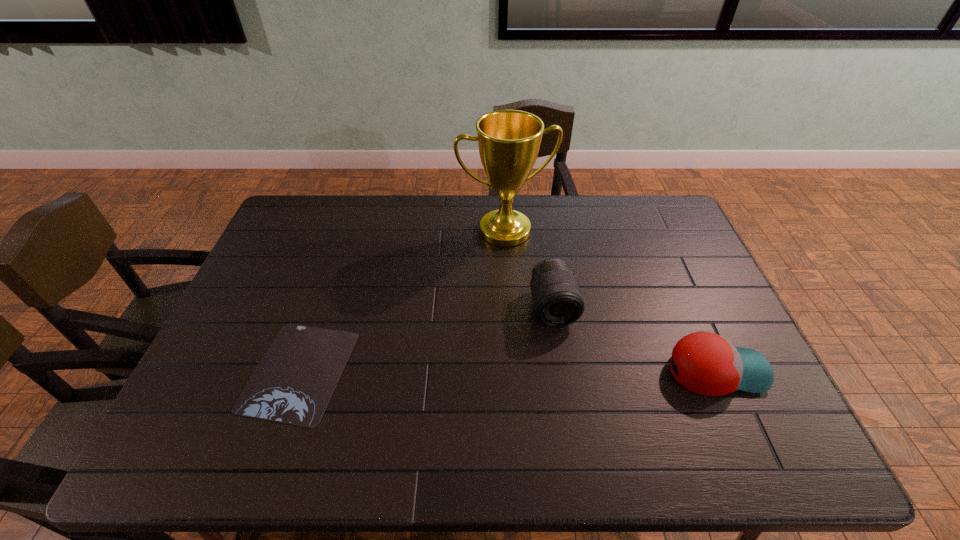
Image resolution: width=960 pixels, height=540 pixels. In order to click on object present at the near right corner in this screenshot , I will do `click(708, 364)`.

In the image, there is a desktop. Identify the location of vacant space at the far edge. (617, 198).

Where is `vacant region at the near edge of the desktop`? vacant region at the near edge of the desktop is located at coordinates click(571, 399).

Where is `blank area at the left edge`? The height and width of the screenshot is (540, 960). blank area at the left edge is located at coordinates tap(235, 372).

This screenshot has height=540, width=960. I want to click on vacant space at the right edge, so click(705, 296).

The image size is (960, 540). I want to click on free spot at the far left corner of the desktop, so click(323, 233).

Locate an element on the screen. The image size is (960, 540). vacant region at the near right corner of the desktop is located at coordinates (724, 406).

What are the coordinates of `free space between the farthest object and the baseball cap` in the screenshot? It's located at (611, 301).

Where is `free space between the shortest object and the award`? free space between the shortest object and the award is located at coordinates pyautogui.click(x=402, y=301).

Locate an element on the screen. vacant region between the mousepad and the third shortest object is located at coordinates (426, 339).